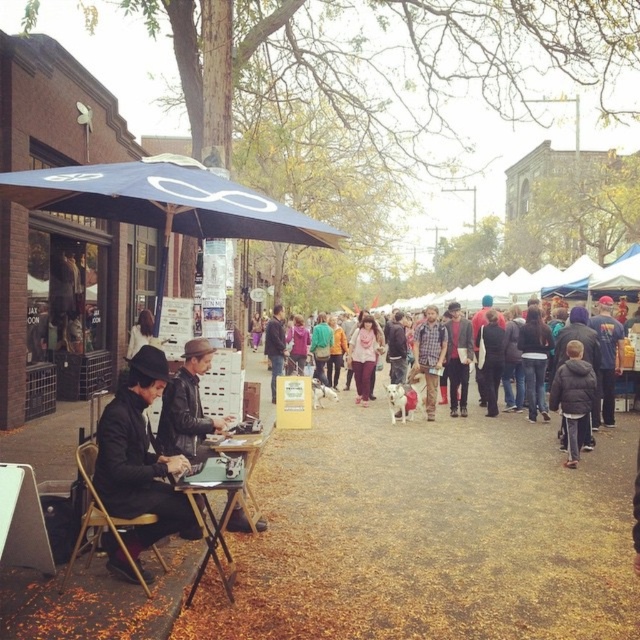
You are a participant in this event and need to move from the wooden table at lower left to the wooden table at center. Which direction should you move to reach the destination?

You should move to the right to reach the wooden table at center from the wooden table at lower left, as the wooden table at lower left is located to the left of the wooden table at center.

You are a photographer trying to capture a shot of the wooden table at lower left without the navy blue fabric umbrella at upper left blocking the view. Based on their positions, is this possible?

Yes, the navy blue fabric umbrella at upper left is to the left of the wooden table at lower left, so positioning yourself to the right side of the table would allow you to frame the shot without the umbrella obstructing the view.